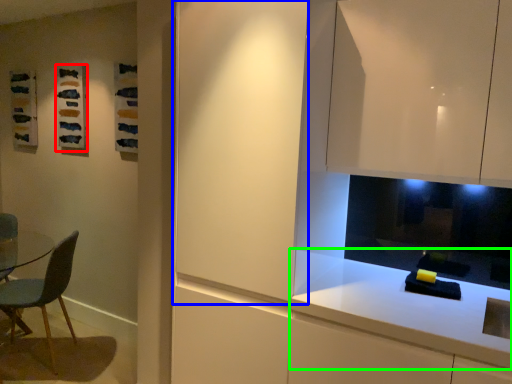
Question: Estimate the real-world distances between objects in this image. Which object is farther from art (highlighted by a red box), glass door (highlighted by a blue box) or countertop (highlighted by a green box)?

Choices:
 (A) glass door
 (B) countertop

Answer: (B)